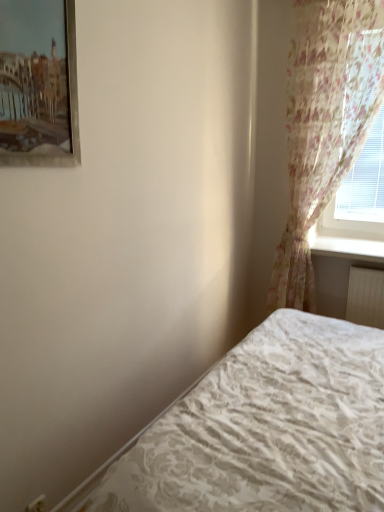
Locate an element on the screen. The height and width of the screenshot is (512, 384). blank space situated above white glossy window sill at upper right (from a real-world perspective) is located at coordinates pyautogui.click(x=355, y=242).